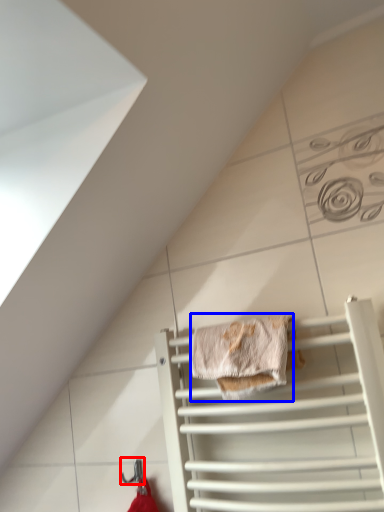
Question: Among these objects, which one is farthest to the camera, hanger (highlighted by a red box) or material (highlighted by a blue box)?

Choices:
 (A) hanger
 (B) material

Answer: (A)